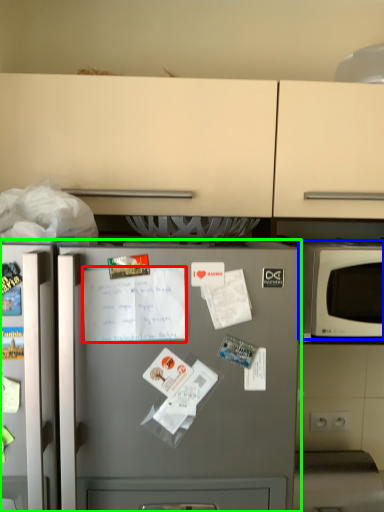
Question: Which object is the closest to the receipt (highlighted by a red box)? Choose among these: microwave oven (highlighted by a blue box) or refrigerator (highlighted by a green box).

Choices:
 (A) microwave oven
 (B) refrigerator

Answer: (B)